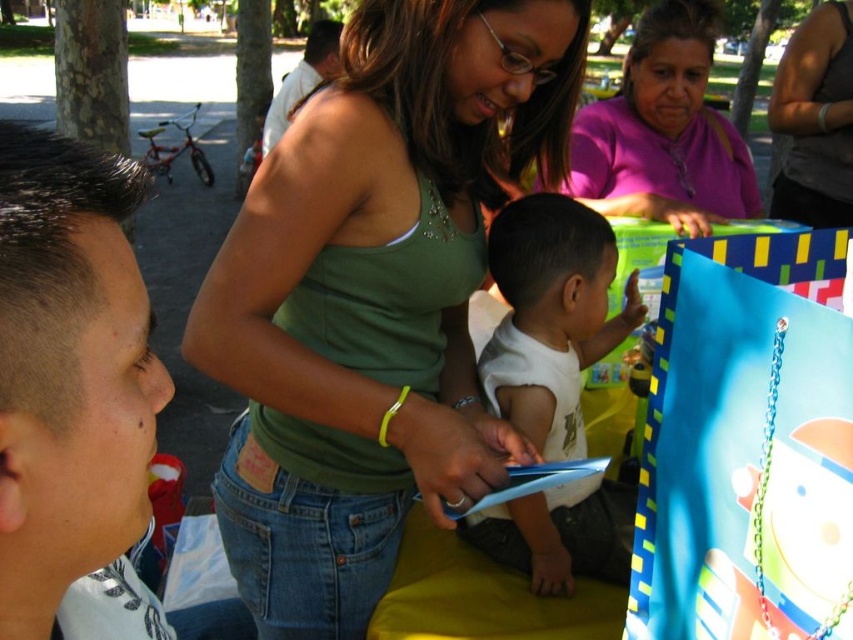
Who is higher up, green tank top at center or white matte shirt at center?

green tank top at center is above.

Which is behind, point (509, 429) or point (607, 259)?

The point (607, 259) is more distant.

Locate an element on the screen. This screenshot has height=640, width=853. green tank top at center is located at coordinates (373, 298).

Can you confirm if white matte shirt at center is smaller than light brown leather jacket at upper center?

Yes, white matte shirt at center is smaller than light brown leather jacket at upper center.

Does white matte shirt at center come behind light brown leather jacket at upper center?

No.

Between point (554, 356) and point (289, 88), which one is positioned behind?

The point (289, 88) is more distant.

The image size is (853, 640). What are the coordinates of `white matte shirt at center` in the screenshot? It's located at (550, 316).

Between dark gray tank top at upper right and light brown leather jacket at upper center, which one appears on the left side from the viewer's perspective?

From the viewer's perspective, light brown leather jacket at upper center appears more on the left side.

Which is behind, point (831, 61) or point (331, 58)?

The point (331, 58) is behind.

The image size is (853, 640). Find the location of `dark gray tank top at upper right`. dark gray tank top at upper right is located at coordinates pos(815,120).